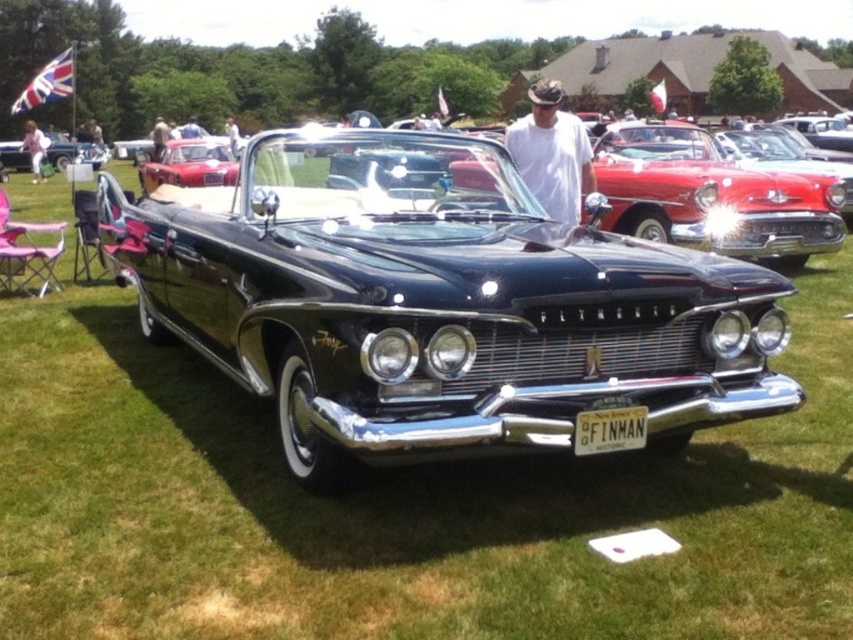
Does point (569, 131) lie in front of point (24, 170)?

That is True.

Does white cotton shirt at center appear on the left side of shiny chrome car at center?

No, white cotton shirt at center is not to the left of shiny chrome car at center.

Who is more distant from viewer, (537, 115) or (57, 170)?

Positioned behind is point (57, 170).

Identify the location of white cotton shirt at center. click(552, 154).

Is point (296, 360) positioned in front of point (56, 147)?

Yes, it is in front of point (56, 147).

Is shiny black car at center wider than shiny chrome car at center?

No.

Find the location of a particular element. shiny black car at center is located at coordinates (436, 304).

Who is lower down, shiny red car at upper left or black metal license plate at center?

black metal license plate at center is below.

Does shiny red car at upper left have a larger size compared to black metal license plate at center?

Yes.

Identify the location of shiny red car at upper left. The image size is (853, 640). (190, 164).